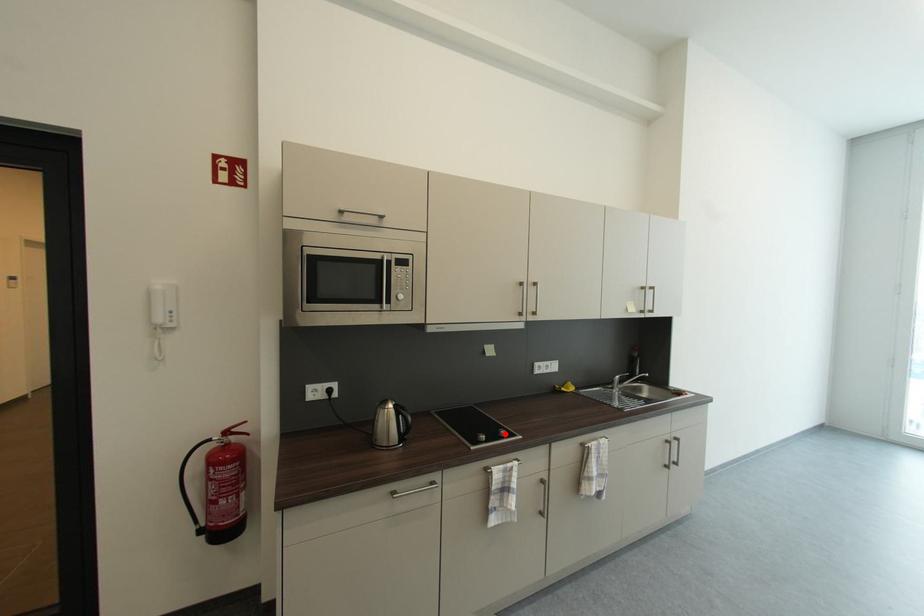
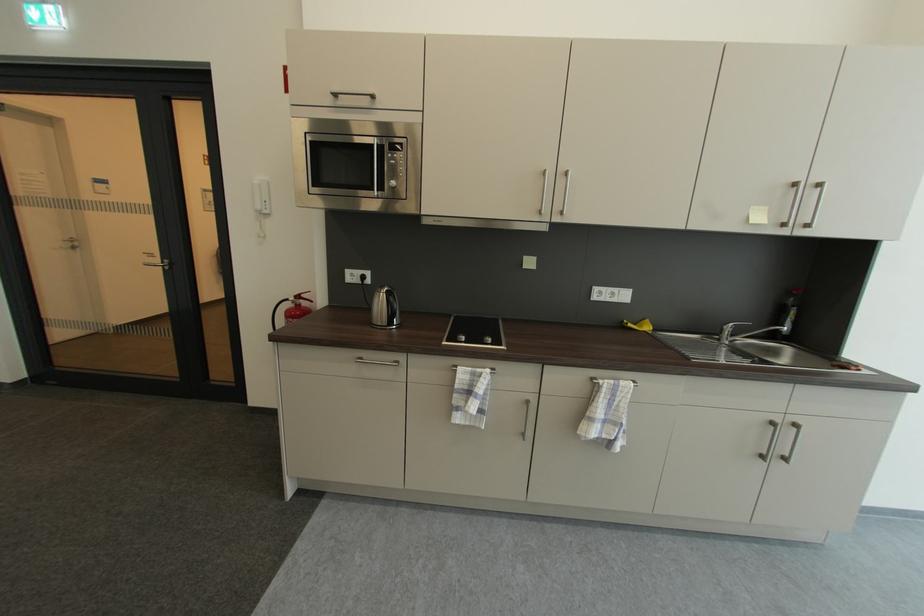
Find the pixel in the second image that matches the highlighted location in the first image.

(490, 339)